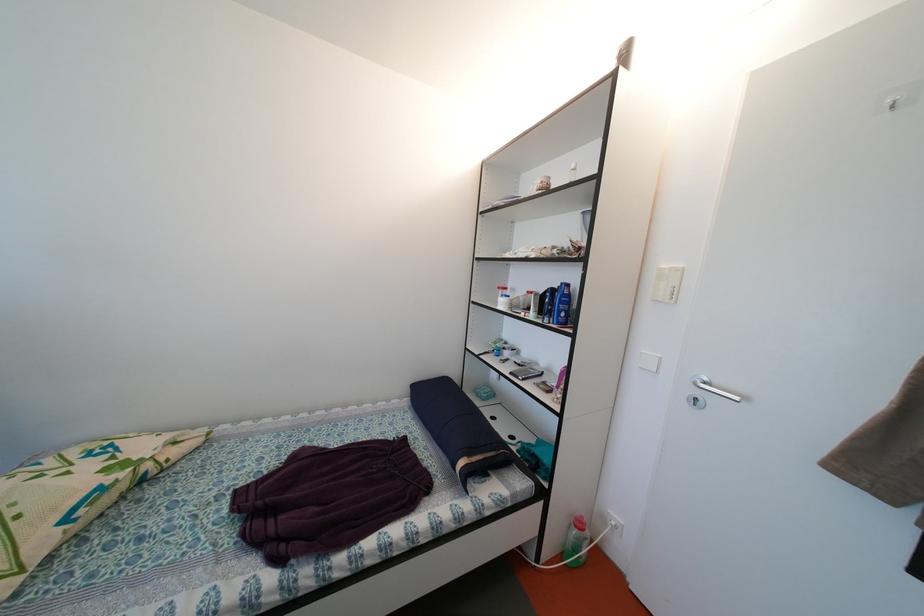
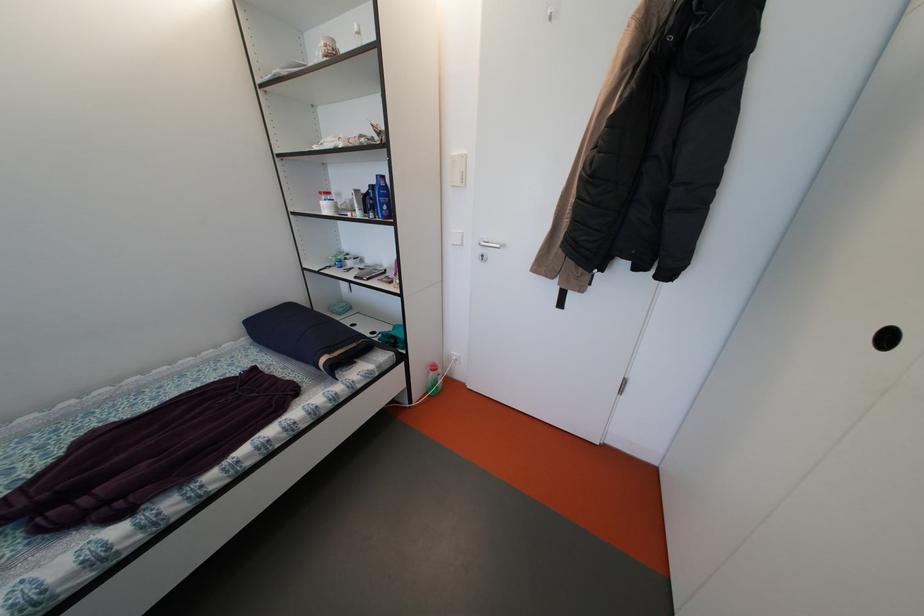
Find the pixel in the second image that matches [468,468] in the first image.

(331, 365)